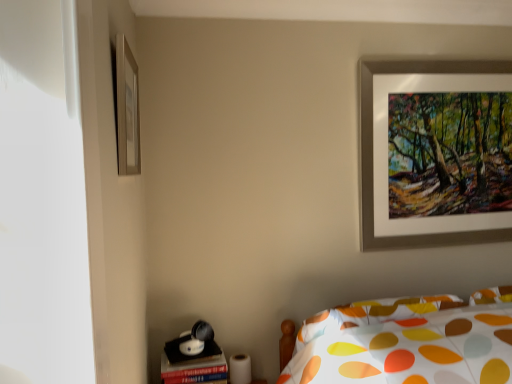
Question: Is silver metallic picture frame at upper left, which ranks as the 2th picture frame in back-to-front order, taller or shorter than matte black table at lower left?

Choices:
 (A) short
 (B) tall

Answer: (B)

Question: In terms of size, does silver metallic picture frame at upper left, which ranks as the 2th picture frame in back-to-front order, appear bigger or smaller than matte black table at lower left?

Choices:
 (A) small
 (B) big

Answer: (A)

Question: Considering the real-world distances, which object is farthest from the silver metallic picture frame at upper left, acting as the first picture frame starting from the front?

Choices:
 (A) matte black table at lower left
 (B) silver metallic picture frame at upper right, which is counted as the second picture frame, starting from the front

Answer: (B)

Question: Which of these objects is positioned closest to the silver metallic picture frame at upper right, which is counted as the second picture frame, starting from the front?

Choices:
 (A) matte black table at lower left
 (B) silver metallic picture frame at upper left, positioned as the second picture frame in right-to-left order

Answer: (A)